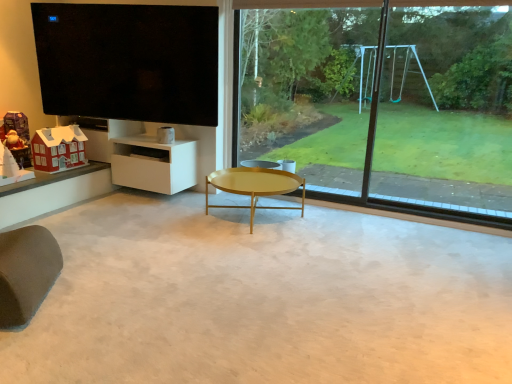
The image size is (512, 384). Identify the location of matte red house at lower left, the 2th toy in the left-to-right sequence. (58, 149).

Describe the element at coordinates (17, 137) in the screenshot. I see `matte plastic santa at left, which is counted as the second toy, starting from the right` at that location.

This screenshot has width=512, height=384. Describe the element at coordinates (128, 61) in the screenshot. I see `black glossy tv at upper left` at that location.

Where is `black glass window frame at right`? This screenshot has width=512, height=384. black glass window frame at right is located at coordinates (447, 110).

Where is `matte red house at lower left, the 2th toy in the left-to-right sequence`? The height and width of the screenshot is (384, 512). matte red house at lower left, the 2th toy in the left-to-right sequence is located at coordinates (58, 149).

Based on the photo, considering the positions of objects gold metallic coffee table at center and brown fabric swivel chair at lower left in the image provided, who is more to the left, gold metallic coffee table at center or brown fabric swivel chair at lower left?

brown fabric swivel chair at lower left.

From the picture: Which is closer to the camera, (282, 176) or (3, 252)?

Point (282, 176).

You are a GUI agent. You are given a task and a screenshot of the screen. Output one action in this format:
    pyautogui.click(x=<x>, y=<y>)
    Task: Click on the swivel chair below the gold metallic coffee table at center (from the image's perspective)
    The height and width of the screenshot is (384, 512).
    Given the screenshot: What is the action you would take?
    pyautogui.click(x=26, y=273)

Considering the positions of objects black glossy tv at upper left and transparent glass window at center in the image provided, who is behind, black glossy tv at upper left or transparent glass window at center?

black glossy tv at upper left is further away from the camera.

From their relative heights in the image, would you say black glossy tv at upper left is taller or shorter than transparent glass window at center?

Considering their sizes, black glossy tv at upper left has less height than transparent glass window at center.

From the image's perspective, is black glossy tv at upper left over transparent glass window at center?

Yes.

In the scene shown: Which of these two, black glossy tv at upper left or transparent glass window at center, is wider?

With larger width is black glossy tv at upper left.

Looking at this image, from a real-world perspective, is white matte cabinet at lower left under black glossy tv at upper left?

Yes, from a real-world perspective, white matte cabinet at lower left is below black glossy tv at upper left.

Where is `window screen on the left of white matte cabinet at lower left`? Image resolution: width=512 pixels, height=384 pixels. window screen on the left of white matte cabinet at lower left is located at coordinates (128, 61).

Does white matte cabinet at lower left have a lesser width compared to black glossy tv at upper left?

Incorrect, the width of white matte cabinet at lower left is not less than that of black glossy tv at upper left.

Looking at this image, can we say white matte cabinet at lower left lies outside black glossy tv at upper left?

white matte cabinet at lower left is positioned outside black glossy tv at upper left.

Is matte red house at lower left, marked as the first toy in a right-to-left arrangement, completely or partially outside of white matte cabinet at lower left?

That's correct, matte red house at lower left, marked as the first toy in a right-to-left arrangement, is outside of white matte cabinet at lower left.

From a real-world perspective, which toy is the 1st one above the white matte cabinet at lower left? Please provide its 2D coordinates.

[(58, 149)]

Considering the sizes of matte red house at lower left, the 2th toy in the left-to-right sequence, and white matte cabinet at lower left in the image, is matte red house at lower left, the 2th toy in the left-to-right sequence, bigger or smaller than white matte cabinet at lower left?

Clearly, matte red house at lower left, the 2th toy in the left-to-right sequence, is smaller in size than white matte cabinet at lower left.

From the image's perspective, is black glass window frame at right located above or below white matte cabinet at lower left?

From the image's perspective, black glass window frame at right appears above white matte cabinet at lower left.

Considering the relative positions of black glass window frame at right and white matte cabinet at lower left in the image provided, is black glass window frame at right behind white matte cabinet at lower left?

No, black glass window frame at right is closer to the viewer.

In the scene shown: From a real-world perspective, is black glass window frame at right above or below white matte cabinet at lower left?

black glass window frame at right is situated higher than white matte cabinet at lower left in the real world.

How much distance is there between black glass window frame at right and white matte cabinet at lower left?

2.04 meters.

Is transparent glass window at center taller or shorter than matte red house at lower left, the 2th toy in the left-to-right sequence?

Clearly, transparent glass window at center is taller compared to matte red house at lower left, the 2th toy in the left-to-right sequence.

Based on the photo, from a real-world perspective, does transparent glass window at center stand above matte red house at lower left, the 2th toy in the left-to-right sequence?

Correct, in the physical world, transparent glass window at center is higher than matte red house at lower left, the 2th toy in the left-to-right sequence.

Looking at this image, is transparent glass window at center situated inside matte red house at lower left, marked as the first toy in a right-to-left arrangement, or outside?

transparent glass window at center is located beyond the bounds of matte red house at lower left, marked as the first toy in a right-to-left arrangement.

Could you tell me if black glossy tv at upper left is turned towards white matte cabinet at lower left?

No, black glossy tv at upper left is not aimed at white matte cabinet at lower left.

From a real-world perspective, who is located higher, black glossy tv at upper left or white matte cabinet at lower left?

black glossy tv at upper left, from a real-world perspective.

Image resolution: width=512 pixels, height=384 pixels. Find the location of `shelf that appears below the black glossy tv at upper left (from the image's perspective)`. shelf that appears below the black glossy tv at upper left (from the image's perspective) is located at coordinates (154, 164).

From their relative heights in the image, would you say black glossy tv at upper left is taller or shorter than white matte cabinet at lower left?

Clearly, black glossy tv at upper left is taller compared to white matte cabinet at lower left.

Find the location of a particular element. coffee table located underneath the brown fabric swivel chair at lower left (from a real-world perspective) is located at coordinates (255, 186).

Image resolution: width=512 pixels, height=384 pixels. Identify the location of window on the right of black glossy tv at upper left. (383, 101).

From the image, which object appears to be farther from white matte cabinet at lower left, black glossy tv at upper left or black glass window frame at right?

black glass window frame at right is positioned further to the anchor white matte cabinet at lower left.

When comparing their distances from transparent glass window at center, does gold metallic coffee table at center or matte plastic santa at left, which is counted as the second toy, starting from the right, seem further?

Based on the image, matte plastic santa at left, which is counted as the second toy, starting from the right, appears to be further to transparent glass window at center.

Based on their spatial positions, is white matte cabinet at lower left or matte red house at lower left, the 2th toy in the left-to-right sequence, closer to black glossy tv at upper left?

white matte cabinet at lower left lies closer to black glossy tv at upper left than the other object.

Which object lies nearer to the anchor point brown fabric swivel chair at lower left, black glass window frame at right or gold metallic coffee table at center?

gold metallic coffee table at center is closer to brown fabric swivel chair at lower left.

Estimate the real-world distances between objects in this image. Which object is further from transparent glass window at center, white matte cabinet at lower left or black glossy tv at upper left?

black glossy tv at upper left.

Estimate the real-world distances between objects in this image. Which object is further from matte red house at lower left, marked as the first toy in a right-to-left arrangement, matte plastic santa at left, the 1th toy when ordered from left to right, or gold metallic coffee table at center?

Among the two, gold metallic coffee table at center is located further to matte red house at lower left, marked as the first toy in a right-to-left arrangement.

Consider the image. From the image, which object appears to be nearer to white matte cabinet at lower left, gold metallic coffee table at center or transparent glass window at center?

Based on the image, gold metallic coffee table at center appears to be nearer to white matte cabinet at lower left.

Estimate the real-world distances between objects in this image. Which object is closer to transparent glass window at center, brown fabric swivel chair at lower left or gold metallic coffee table at center?

Among the two, gold metallic coffee table at center is located nearer to transparent glass window at center.

This screenshot has width=512, height=384. In order to click on coffee table between brown fabric swivel chair at lower left and matte red house at lower left, the 2th toy in the left-to-right sequence, along the z-axis in this screenshot , I will do `click(255, 186)`.

Find the location of `window screen between brown fabric swivel chair at lower left and matte red house at lower left, the 2th toy in the left-to-right sequence, in the front-back direction`. window screen between brown fabric swivel chair at lower left and matte red house at lower left, the 2th toy in the left-to-right sequence, in the front-back direction is located at coordinates (128, 61).

Locate an element on the screen. shelf between matte red house at lower left, the 2th toy in the left-to-right sequence, and transparent glass window at center from left to right is located at coordinates (154, 164).

This screenshot has height=384, width=512. What are the coordinates of `swivel chair situated between matte red house at lower left, the 2th toy in the left-to-right sequence, and black glass window frame at right from left to right` in the screenshot? It's located at (26, 273).